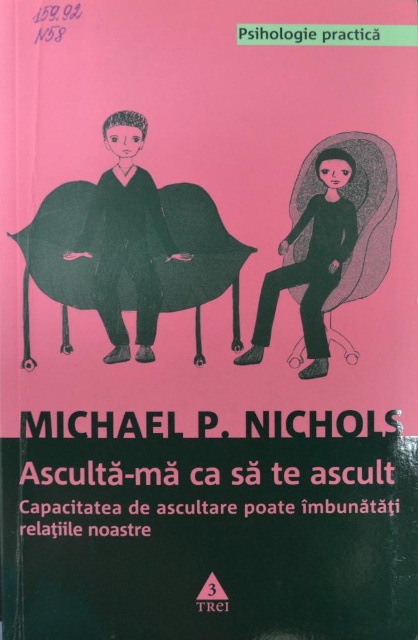
Question: Among these points, which one is nearest to the camera?

Choices:
 (A) (214, 461)
 (B) (313, 365)

Answer: (A)

Question: Which point is farther to the camera?

Choices:
 (A) (102, 204)
 (B) (295, 273)

Answer: (B)

Question: Does matte black suit at center come behind black matte figure at center?

Choices:
 (A) yes
 (B) no

Answer: (B)

Question: In this image, where is matte black suit at center located relative to matte black blanket at center?

Choices:
 (A) below
 (B) above

Answer: (A)

Question: Considering the relative positions of white paper at center and matte black blanket at center in the image provided, where is white paper at center located with respect to matte black blanket at center?

Choices:
 (A) left
 (B) right

Answer: (A)

Question: Estimate the real-world distances between objects in this image. Which object is closer to the white paper at center?

Choices:
 (A) matte black blanket at center
 (B) matte black suit at center

Answer: (B)